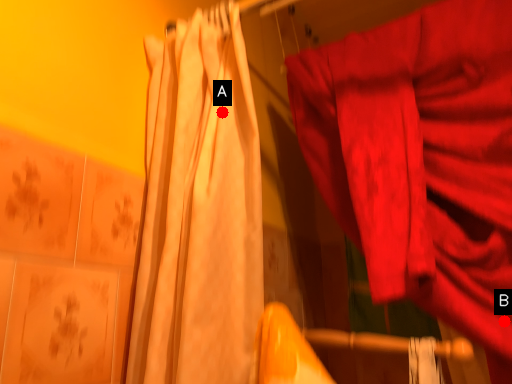
Question: Two points are circled on the image, labeled by A and B beside each circle. Among these points, which one is farthest from the camera?

Choices:
 (A) A is further
 (B) B is further

Answer: (A)